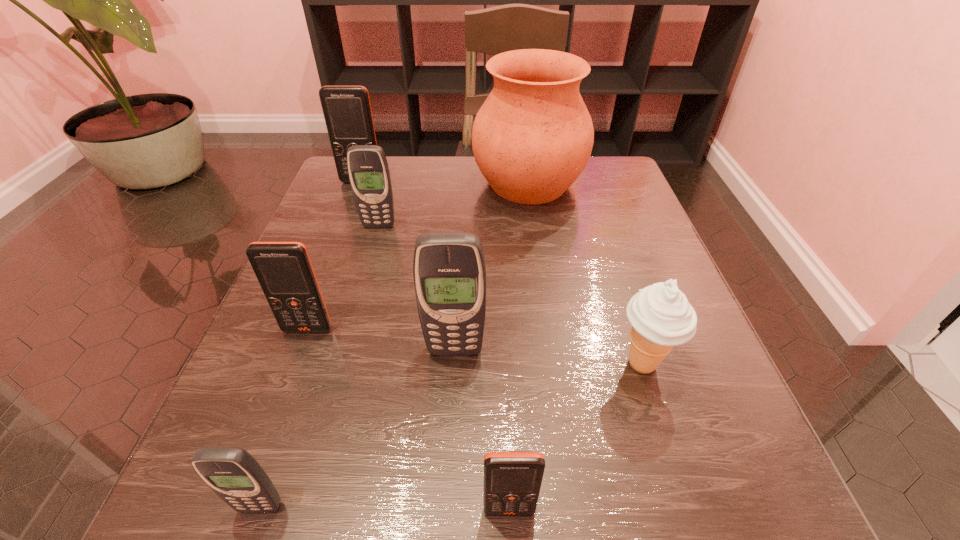
The height and width of the screenshot is (540, 960). I want to click on the rightmost orange cellular telephone, so click(512, 480).

Where is `the smallest orange cellular telephone`? This screenshot has width=960, height=540. the smallest orange cellular telephone is located at coordinates tap(512, 480).

Where is `the smallest gray cellular telephone`? the smallest gray cellular telephone is located at coordinates (232, 473).

Locate an element on the screen. Image resolution: width=960 pixels, height=540 pixels. vacant space located 0.240m on the left of the tallest object is located at coordinates (372, 184).

Where is `vacant area located on the screen of the farthest orange cellular telephone`? The width and height of the screenshot is (960, 540). vacant area located on the screen of the farthest orange cellular telephone is located at coordinates (353, 203).

The width and height of the screenshot is (960, 540). In order to click on vacant space situated 0.140m on the screen of the second nearest gray cellular telephone in this screenshot , I will do `click(450, 443)`.

Where is `vacant space located 0.080m on the screen of the third farthest object`? vacant space located 0.080m on the screen of the third farthest object is located at coordinates (372, 253).

Find the location of a particular element. The image size is (960, 540). free space located 0.250m on the screen of the fourth farthest object is located at coordinates (247, 496).

I want to click on vacant space located 0.240m on the left of the beige icecream, so click(454, 363).

The image size is (960, 540). I want to click on pottery located in the far edge section of the desktop, so click(x=533, y=136).